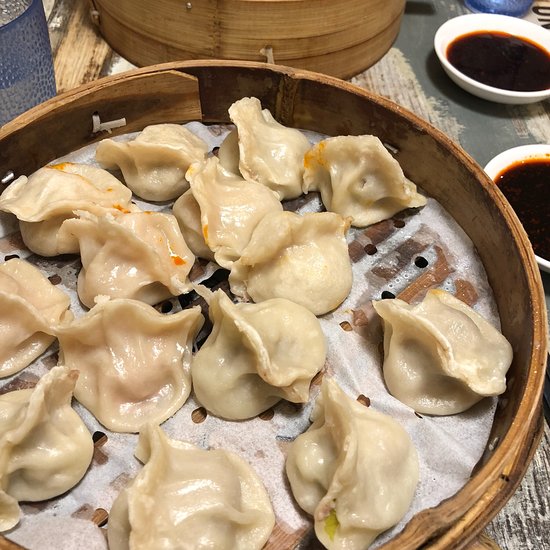
Where is `wood table`? Image resolution: width=550 pixels, height=550 pixels. wood table is located at coordinates (416, 92).